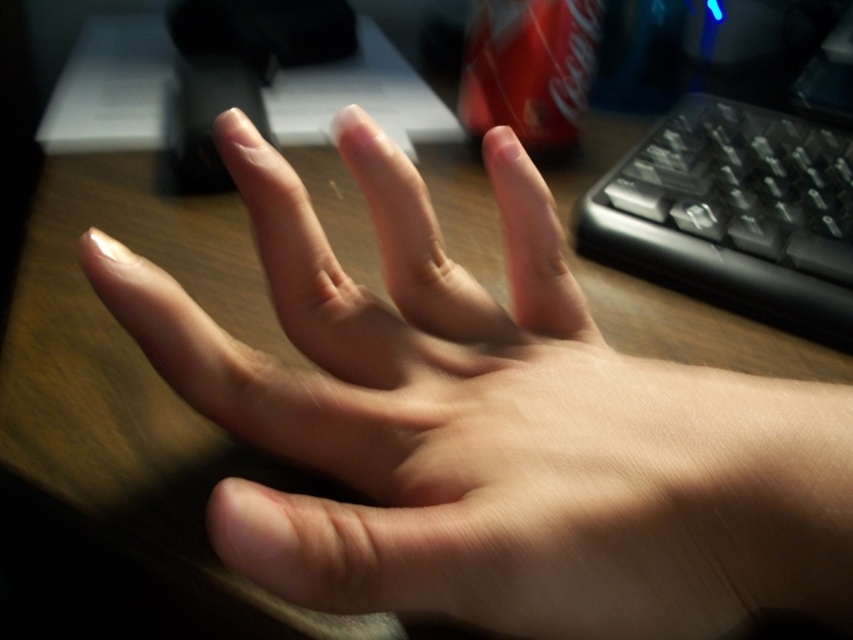
You are organizing items on your desk and need to place the black plastic keyboard at right and the matte red can at upper center. If you want to stack them vertically, which one should go on the bottom to support the other?

The black plastic keyboard at right is much taller than the matte red can at upper center, so it should be placed on the bottom to support the can.

You are organizing items on a desk and notice the black plastic keyboard at right and the matte red can at upper center. Which item is located to the right of the other?

The black plastic keyboard at right is positioned on the right side of the matte red can at upper center, so the keyboard is to the right of the can.

You are organizing a desk and need to place both the black plastic keyboard at right and the matte red can at upper center. If you want to place the larger item closer to the edge of the desk, which object should you position there?

The black plastic keyboard at right is larger than the matte red can at upper center, so you should position the black plastic keyboard at right closer to the edge of the desk.